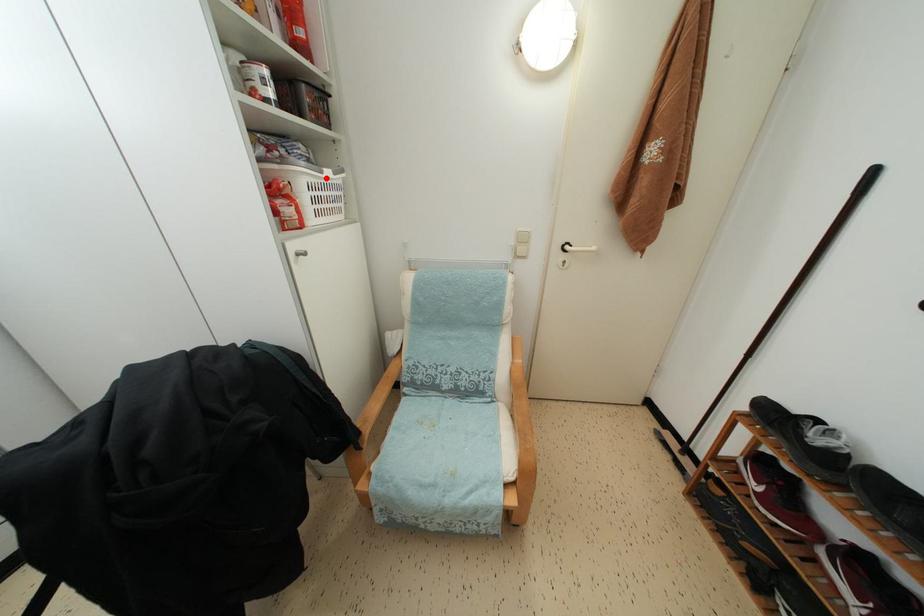
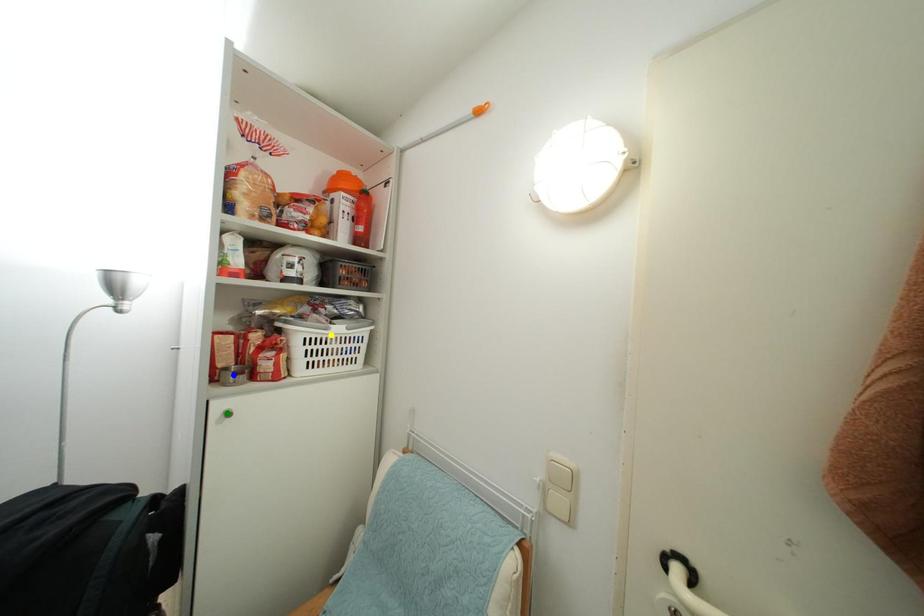
Question: I am providing you with two images of the same scene from different viewpoints. A red point is marked on the first image. You are given multiple points on the second image. Which mark in image 2 goes with the point in image 1?

Choices:
 (A) green point
 (B) blue point
 (C) yellow point

Answer: (C)